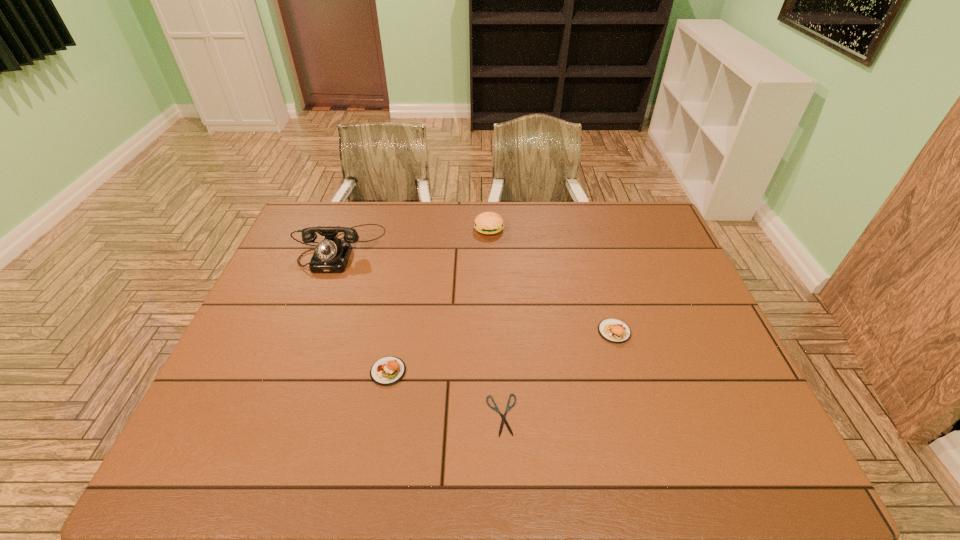
The width and height of the screenshot is (960, 540). I want to click on blank region between the second nearest object and the leftmost object, so click(364, 309).

The height and width of the screenshot is (540, 960). In order to click on free space between the shortest object and the farthest patty (food) in this screenshot , I will do `click(495, 322)`.

Locate an element on the screen. empty space between the leftmost object and the fourth farthest object is located at coordinates (364, 309).

At what (x,y) coordinates should I click in order to perform the action: click on unoccupied position between the tallest object and the second shortest object. Please return your answer as a coordinate pair (x, y). Image resolution: width=960 pixels, height=540 pixels. Looking at the image, I should click on (364, 309).

Select which object appears as the fourth closest to the telephone. Please provide its 2D coordinates. Your answer should be formatted as a tuple, i.e. [(x, y)], where the tuple contains the x and y coordinates of a point satisfying the conditions above.

[(613, 330)]

Locate which object ranks second in proximity to the second nearest object. Please provide its 2D coordinates. Your answer should be formatted as a tuple, i.e. [(x, y)], where the tuple contains the x and y coordinates of a point satisfying the conditions above.

[(331, 255)]

Locate which patty (food) ranks third in proximity to the leftmost object. Please provide its 2D coordinates. Your answer should be formatted as a tuple, i.e. [(x, y)], where the tuple contains the x and y coordinates of a point satisfying the conditions above.

[(613, 330)]

I want to click on the second closest patty (food) to the shears, so [x=613, y=330].

Where is `free space in the image that satisfies the following two spatial constraints: 1. on the front-facing side of the tallest object; 2. on the right side of the shortest object`? free space in the image that satisfies the following two spatial constraints: 1. on the front-facing side of the tallest object; 2. on the right side of the shortest object is located at coordinates (277, 415).

Where is `vacant area that satisfies the following two spatial constraints: 1. on the front-facing side of the telephone; 2. on the right side of the third farthest object`? The image size is (960, 540). vacant area that satisfies the following two spatial constraints: 1. on the front-facing side of the telephone; 2. on the right side of the third farthest object is located at coordinates (308, 332).